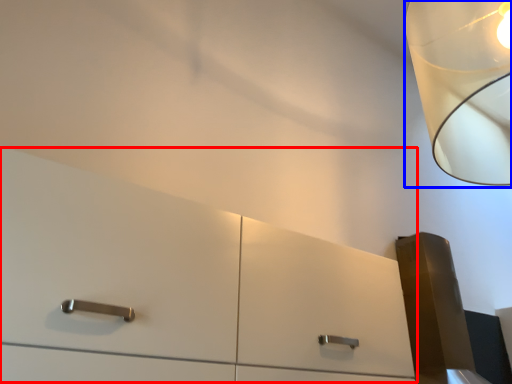
Question: Which point is closer to the camera, dresser (highlighted by a red box) or lamp (highlighted by a blue box)?

Choices:
 (A) dresser
 (B) lamp

Answer: (A)